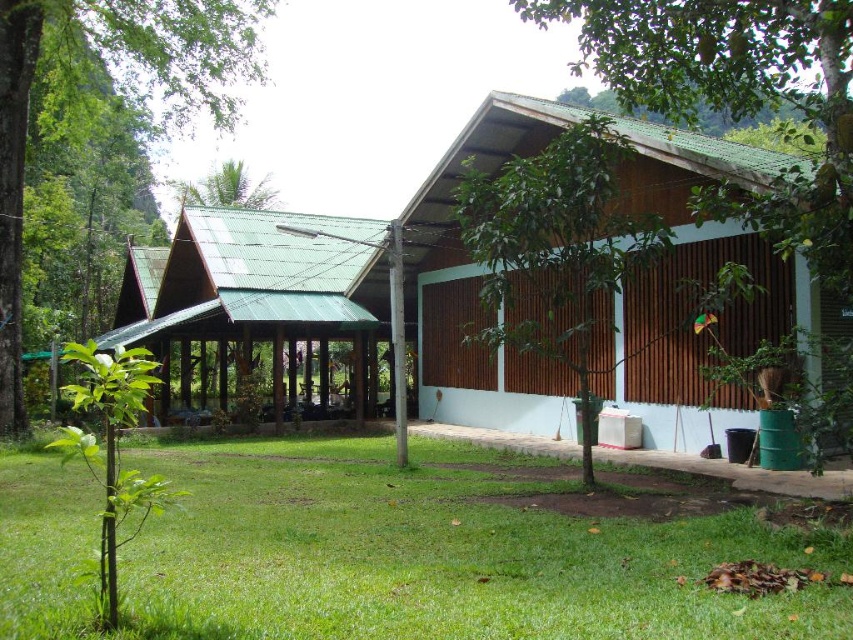
Question: Which point is farther from the camera taking this photo?

Choices:
 (A) (241, 176)
 (B) (799, 323)
 (C) (212, 337)
 (D) (229, 506)

Answer: (A)

Question: Can you confirm if green grass at lower center is wider than green corrugated metal hut at center?

Choices:
 (A) yes
 (B) no

Answer: (A)

Question: Does green grass at lower center have a larger size compared to green leafy palm tree at upper left?

Choices:
 (A) yes
 (B) no

Answer: (B)

Question: Can you confirm if green grass at lower center is thinner than green leafy palm tree at upper left?

Choices:
 (A) yes
 (B) no

Answer: (B)

Question: Estimate the real-world distances between objects in this image. Which object is farther from the brown wood hut at center?

Choices:
 (A) green leafy palm tree at upper left
 (B) green leafy tree at left
 (C) green grass at lower center

Answer: (A)

Question: Estimate the real-world distances between objects in this image. Which object is closer to the green leafy palm tree at upper left?

Choices:
 (A) green corrugated metal hut at center
 (B) green grass at lower center

Answer: (A)